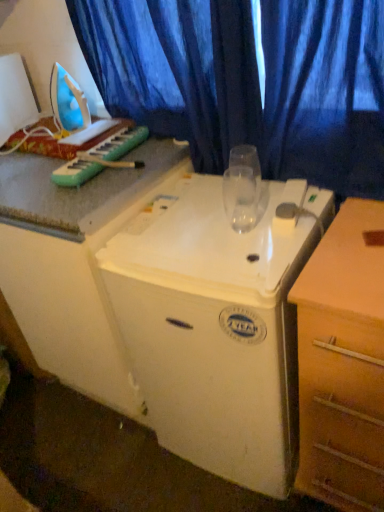
This screenshot has width=384, height=512. I want to click on white plastic refrigerator at center, the first appliance in the right-to-left sequence, so click(x=217, y=323).

What is the approximate height of white plastic iron at left, which is the second appliance in right-to-left order?

white plastic iron at left, which is the second appliance in right-to-left order, is 28.63 centimeters in height.

What do you see at coordinates (16, 96) in the screenshot?
I see `white plastic iron at left, which is the second appliance in right-to-left order` at bounding box center [16, 96].

Identify the location of transparent glass at center. (242, 188).

Would you say white plastic iron at left, the first appliance positioned from the left, contains white plastic refrigerator at center, the 2th appliance from the top?

That's incorrect, white plastic refrigerator at center, the 2th appliance from the top, is not inside white plastic iron at left, the first appliance positioned from the left.

Is the surface of white plastic iron at left, acting as the second appliance starting from the bottom, in direct contact with white plastic refrigerator at center, the first appliance in the right-to-left sequence?

No.

Considering the sizes of white plastic iron at left, which is the second appliance in right-to-left order, and white plastic refrigerator at center, the 2th appliance from the top, in the image, is white plastic iron at left, which is the second appliance in right-to-left order, bigger or smaller than white plastic refrigerator at center, the 2th appliance from the top,?

white plastic iron at left, which is the second appliance in right-to-left order, is smaller than white plastic refrigerator at center, the 2th appliance from the top.

Is white plastic refrigerator at center, the first appliance from the bottom, at the back of white plastic iron at left, acting as the second appliance starting from the bottom?

No, white plastic refrigerator at center, the first appliance from the bottom, is not at the back of white plastic iron at left, acting as the second appliance starting from the bottom.

Considering the relative sizes of green plastic musical keyboard at upper left and white plastic refrigerator at center, the second appliance in the left-to-right sequence, in the image provided, is green plastic musical keyboard at upper left shorter than white plastic refrigerator at center, the second appliance in the left-to-right sequence,?

Indeed, green plastic musical keyboard at upper left has a lesser height compared to white plastic refrigerator at center, the second appliance in the left-to-right sequence.

From the image's perspective, is green plastic musical keyboard at upper left located above white plastic refrigerator at center, the 2th appliance from the top?

Correct, green plastic musical keyboard at upper left appears higher than white plastic refrigerator at center, the 2th appliance from the top, in the image.

Does green plastic musical keyboard at upper left have a larger size compared to white plastic refrigerator at center, the first appliance from the bottom?

Actually, green plastic musical keyboard at upper left might be smaller than white plastic refrigerator at center, the first appliance from the bottom.

Is green plastic musical keyboard at upper left turned away from white plastic refrigerator at center, the 2th appliance from the top?

No, green plastic musical keyboard at upper left is not facing the opposite direction of white plastic refrigerator at center, the 2th appliance from the top.

Is white plastic iron at left, the first appliance positioned from the left, wider or thinner than blue fabric curtain at upper center?

white plastic iron at left, the first appliance positioned from the left, is wider than blue fabric curtain at upper center.

From a real-world perspective, is white plastic iron at left, which is the second appliance in right-to-left order, beneath blue fabric curtain at upper center?

Incorrect, from a real-world perspective, white plastic iron at left, which is the second appliance in right-to-left order, is higher than blue fabric curtain at upper center.

You are a GUI agent. You are given a task and a screenshot of the screen. Output one action in this format:
    pyautogui.click(x=<x>, y=<y>)
    Task: Click on the appliance behind the blue fabric curtain at upper center
    
    Given the screenshot: What is the action you would take?
    pyautogui.click(x=16, y=96)

Considering the sizes of white plastic iron at left, which is the second appliance in right-to-left order, and blue fabric curtain at upper center in the image, is white plastic iron at left, which is the second appliance in right-to-left order, bigger or smaller than blue fabric curtain at upper center?

Considering their sizes, white plastic iron at left, which is the second appliance in right-to-left order, takes up less space than blue fabric curtain at upper center.

Which object is closer to the camera taking this photo, blue fabric curtain at upper center or transparent glass at center?

blue fabric curtain at upper center is in front.

How far apart are blue fabric curtain at upper center and transparent glass at center?

24.40 centimeters.

Is blue fabric curtain at upper center spatially inside transparent glass at center, or outside of it?

blue fabric curtain at upper center is spatially situated outside transparent glass at center.

Consider the image. Considering the relative sizes of blue fabric curtain at upper center and transparent glass at center in the image provided, is blue fabric curtain at upper center smaller than transparent glass at center?

No.

Considering their positions, is white plastic refrigerator at center, the 2th appliance from the top, located in front of or behind transparent glass at center?

Clearly, white plastic refrigerator at center, the 2th appliance from the top, is in front of transparent glass at center.

Which of these two, white plastic refrigerator at center, the second appliance in the left-to-right sequence, or transparent glass at center, is wider?

Wider between the two is white plastic refrigerator at center, the second appliance in the left-to-right sequence.

Is white plastic refrigerator at center, the first appliance in the right-to-left sequence, spatially inside transparent glass at center, or outside of it?

white plastic refrigerator at center, the first appliance in the right-to-left sequence, is spatially situated outside transparent glass at center.

Which is more to the right, white plastic refrigerator at center, the second appliance in the left-to-right sequence, or transparent glass at center?

Positioned to the right is white plastic refrigerator at center, the second appliance in the left-to-right sequence.

From the image's perspective, is transparent glass at center on top of blue fabric curtain at upper center?

Incorrect, from the image's perspective, transparent glass at center is lower than blue fabric curtain at upper center.

Between point (251, 152) and point (158, 80), which one is positioned in front?

Positioned in front is point (251, 152).

Can you tell me how much transparent glass at center and blue fabric curtain at upper center differ in facing direction?

The facing directions of transparent glass at center and blue fabric curtain at upper center are 25.4 degrees apart.

Is there a large distance between transparent glass at center and blue fabric curtain at upper center?

They are positioned close to each other.

Considering the positions of points (23, 114) and (250, 219), is point (23, 114) farther from camera compared to point (250, 219)?

Yes, point (23, 114) is farther from viewer.

Identify the location of glass vase below the white plastic iron at left, which is the second appliance in right-to-left order (from a real-world perspective). (242, 188).

Which is behind, white plastic iron at left, which is the second appliance in right-to-left order, or transparent glass at center?

white plastic iron at left, which is the second appliance in right-to-left order, is behind.

Image resolution: width=384 pixels, height=512 pixels. I want to click on appliance that appears below the white plastic iron at left, acting as the second appliance starting from the bottom (from a real-world perspective), so click(x=217, y=323).

I want to click on appliance that is in front of the green plastic musical keyboard at upper left, so click(x=217, y=323).

Estimate the real-world distances between objects in this image. Which object is further from white plastic iron at left, which appears as the 1th appliance when viewed from the top, blue fabric curtain at upper center or green plastic musical keyboard at upper left?

blue fabric curtain at upper center is further to white plastic iron at left, which appears as the 1th appliance when viewed from the top.

Looking at the image, which one is located further to wooden chest of drawers at right, white plastic refrigerator at center, the first appliance from the bottom, or transparent glass at center?

Among the two, transparent glass at center is located further to wooden chest of drawers at right.

Considering their positions, is blue fabric curtain at upper center positioned closer to transparent glass at center than green plastic musical keyboard at upper left?

blue fabric curtain at upper center is positioned closer to the anchor transparent glass at center.

Which object lies nearer to the anchor point white plastic refrigerator at center, the first appliance in the right-to-left sequence, wooden chest of drawers at right or white plastic iron at left, which appears as the 1th appliance when viewed from the top?

wooden chest of drawers at right is closer to white plastic refrigerator at center, the first appliance in the right-to-left sequence.

Which object lies nearer to the anchor point blue fabric curtain at upper center, white plastic refrigerator at center, the second appliance in the left-to-right sequence, or white plastic iron at left, which appears as the 1th appliance when viewed from the top?

Based on the image, white plastic refrigerator at center, the second appliance in the left-to-right sequence, appears to be nearer to blue fabric curtain at upper center.

Looking at this image, from the image, which object appears to be farther from white plastic iron at left, which is the second appliance in right-to-left order, green plastic musical keyboard at upper left or blue fabric curtain at upper center?

The object further to white plastic iron at left, which is the second appliance in right-to-left order, is blue fabric curtain at upper center.

Based on their spatial positions, is green plastic musical keyboard at upper left or white plastic refrigerator at center, the first appliance from the bottom, closer to wooden chest of drawers at right?

white plastic refrigerator at center, the first appliance from the bottom, lies closer to wooden chest of drawers at right than the other object.

Looking at the image, which one is located closer to white plastic iron at left, which is the second appliance in right-to-left order, white plastic refrigerator at center, the first appliance in the right-to-left sequence, or wooden chest of drawers at right?

white plastic refrigerator at center, the first appliance in the right-to-left sequence.

This screenshot has height=512, width=384. I want to click on curtain between green plastic musical keyboard at upper left and transparent glass at center in the horizontal direction, so click(x=249, y=81).

The width and height of the screenshot is (384, 512). In order to click on curtain between white plastic iron at left, which is the second appliance in right-to-left order, and transparent glass at center from left to right in this screenshot , I will do `click(249, 81)`.

The width and height of the screenshot is (384, 512). Identify the location of curtain situated between white plastic iron at left, the first appliance positioned from the left, and wooden chest of drawers at right from left to right. (249, 81).

Where is `curtain between white plastic iron at left, the first appliance positioned from the left, and white plastic refrigerator at center, the second appliance in the left-to-right sequence, from left to right`? This screenshot has height=512, width=384. curtain between white plastic iron at left, the first appliance positioned from the left, and white plastic refrigerator at center, the second appliance in the left-to-right sequence, from left to right is located at coordinates (249, 81).